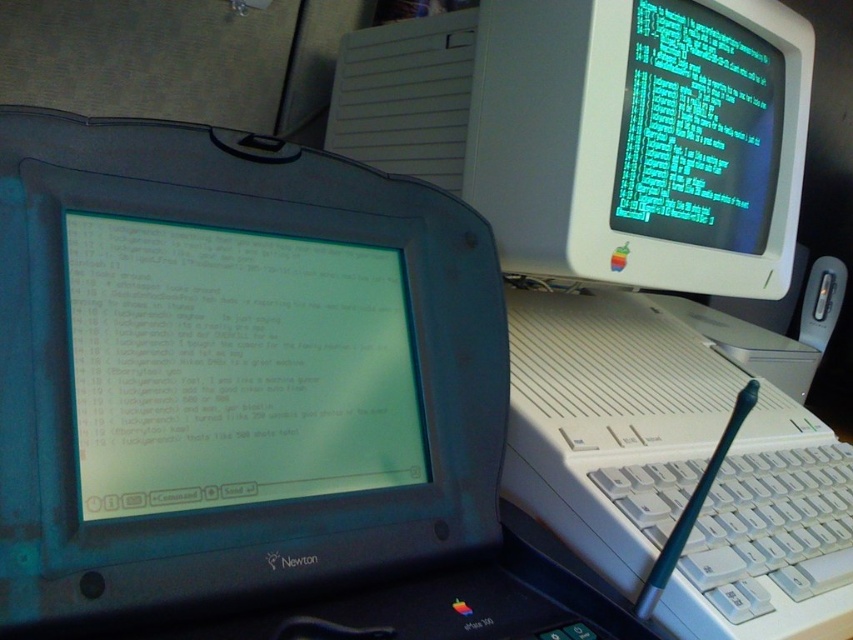
You are setting up a new desk and want to place a white plastic monitor at upper right. Where should you place it?

The white plastic monitor at upper right should be placed at point (598, 131).

You are a delivery person who needs to place a small package on the desk in the image. The package must be placed exactly at the point labeled as point (631, 278). Can you confirm if this point is on the white plastic desktop computer at upper center?

Yes, the point (631, 278) is on the white plastic desktop computer at upper center as stated in the objects description.